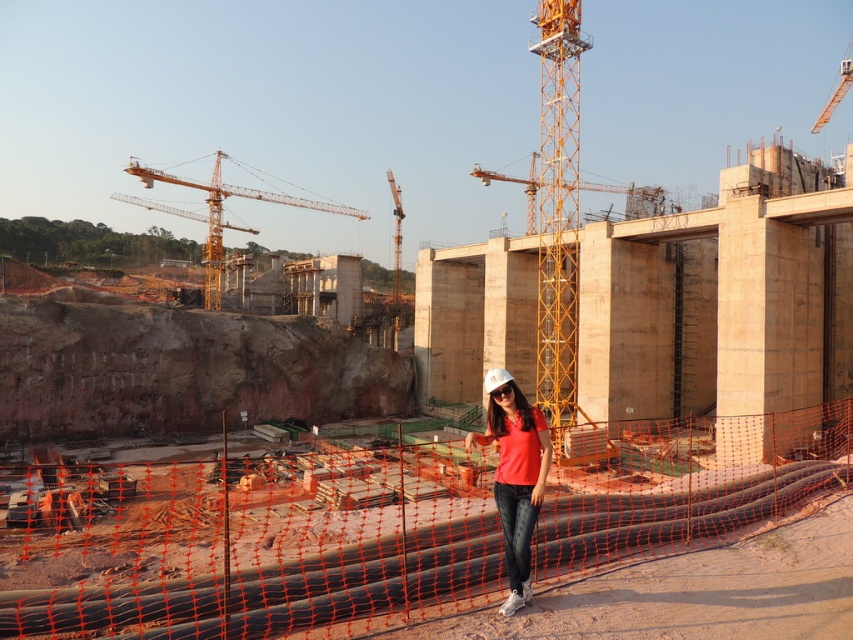
Can you confirm if orange mesh fence at center is bigger than matte red shirt at center?

Yes, orange mesh fence at center is bigger than matte red shirt at center.

Does orange mesh fence at center appear over matte red shirt at center?

No, orange mesh fence at center is not above matte red shirt at center.

Is point (28, 481) positioned behind point (503, 497)?

Yes, it is.

I want to click on orange mesh fence at center, so click(x=245, y=544).

Is point (769, 492) farther from viewer compared to point (172, 211)?

That is False.

The width and height of the screenshot is (853, 640). What do you see at coordinates (245, 544) in the screenshot?
I see `orange mesh fence at center` at bounding box center [245, 544].

Locate an element on the screen. Image resolution: width=853 pixels, height=640 pixels. orange mesh fence at center is located at coordinates (245, 544).

Can you confirm if matte red shirt at center is wider than yellow metallic crane at upper left?

No, matte red shirt at center is not wider than yellow metallic crane at upper left.

Between point (502, 499) and point (204, 307), which one is positioned in front?

Point (502, 499) is in front.

Where is `matte red shirt at center`? This screenshot has height=640, width=853. matte red shirt at center is located at coordinates (514, 474).